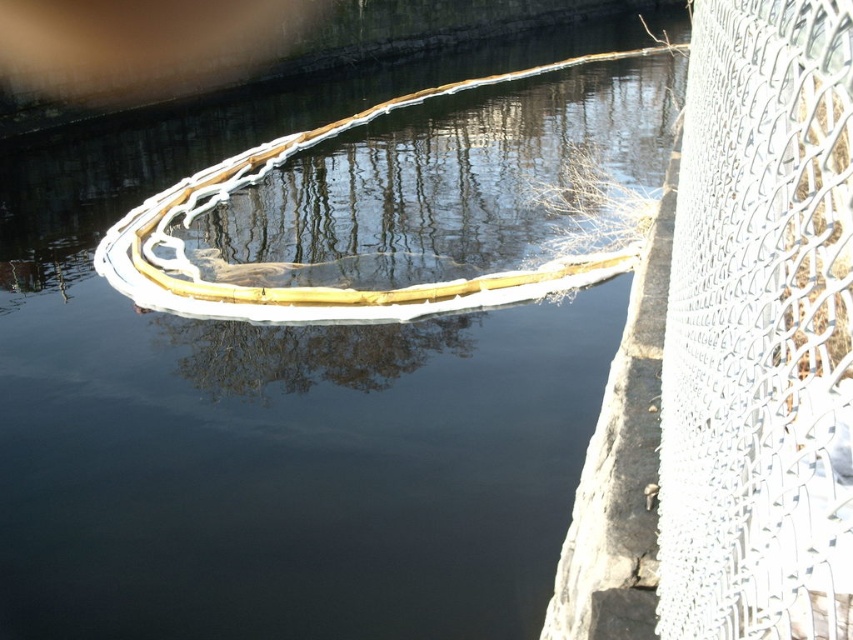
You are standing at the center of the canal and see the point marked at coordinates (x=759, y=330). Based on the scene description, what object is located at that point?

The point at coordinates (x=759, y=330) indicates the white wire mesh fence at right.

You are standing on the bank of the canal and want to cross to the other side. The wooden boat at center is your only option. However, you notice the white wire mesh fence at right might block your path. Based on their positions, can you reach the boat before the fence?

The white wire mesh fence at right is to the left of the wooden boat at center, meaning the boat is positioned further to the right relative to the fence. Since you are on the bank, you would need to move towards the center to reach the boat before encountering the fence on your left side. Therefore, yes, you can reach the wooden boat at center before the white wire mesh fence at right blocks your path.

You are a photographer trying to capture the wooden boat at center and the white wire mesh fence at right in the same frame. Based on their sizes, which object will appear smaller in the photo?

The white wire mesh fence at right will appear smaller in the photo because it is thinner than the wooden boat at center.